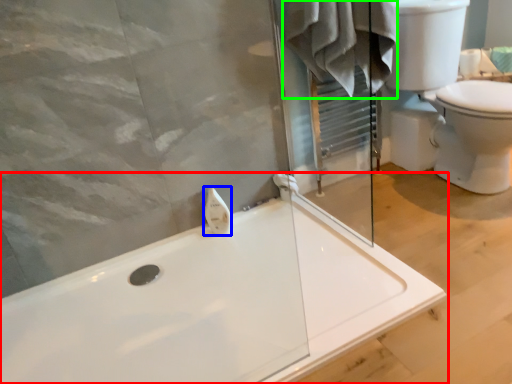
Question: Based on their relative distances, which object is nearer to bathtub (highlighted by a red box)? Choose from toiletry (highlighted by a blue box) and bathrobe (highlighted by a green box).

Choices:
 (A) toiletry
 (B) bathrobe

Answer: (A)